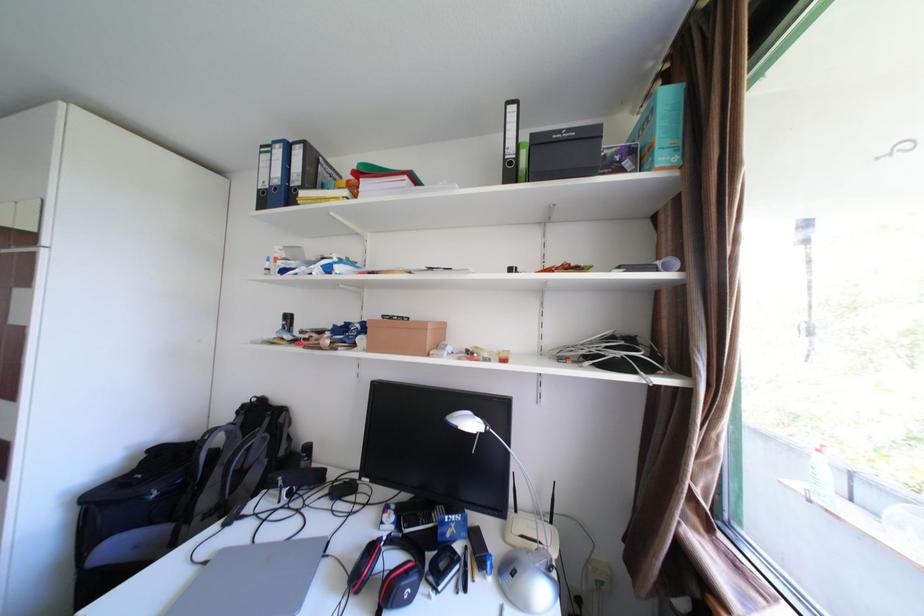
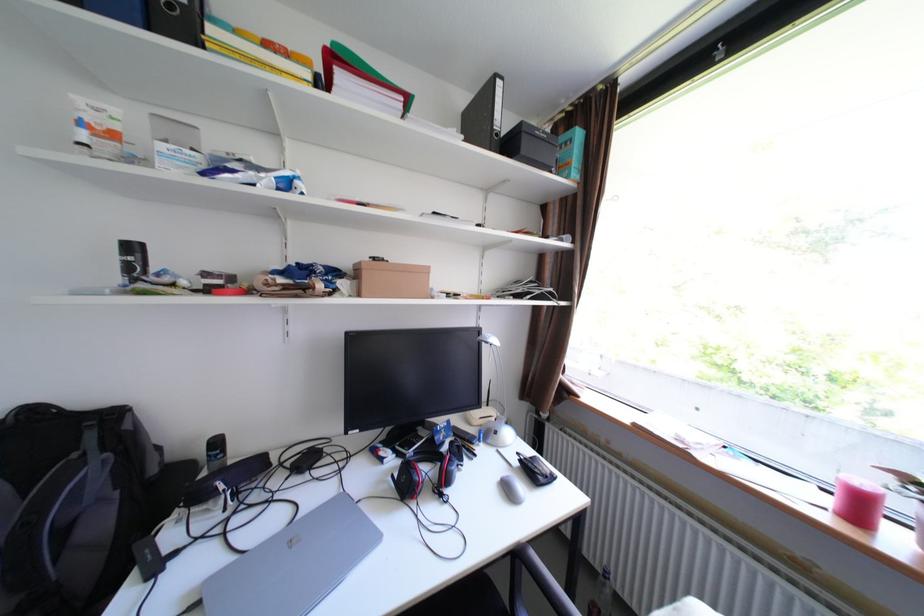
Question: The images are taken continuously from a first-person perspective. In which direction is your viewpoint rotating?

Choices:
 (A) Left
 (B) Right
 (C) Up
 (D) Down

Answer: (B)